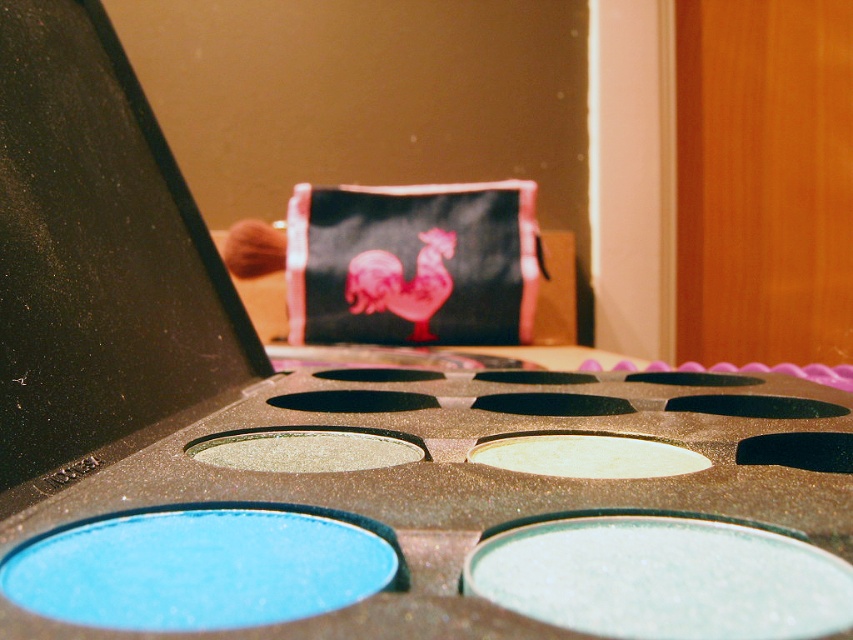
Question: Is satin gold eyeshadow at center further to camera compared to shimmering metallic eyeshadow at center?

Choices:
 (A) no
 (B) yes

Answer: (A)

Question: Among these objects, which one is farthest from the camera?

Choices:
 (A) shimmering teal eyeshadow at center
 (B) satin gold eyeshadow at center
 (C) shimmering metallic eyeshadow at center

Answer: (C)

Question: Does shimmering teal eyeshadow at center have a larger size compared to shimmering metallic eyeshadow at center?

Choices:
 (A) no
 (B) yes

Answer: (A)

Question: Among these objects, which one is nearest to the camera?

Choices:
 (A) shimmering teal eyeshadow at center
 (B) shimmering metallic eyeshadow at center

Answer: (A)

Question: Which object is the farthest from the satin gold eyeshadow at center?

Choices:
 (A) shimmering teal eyeshadow at center
 (B) shimmering metallic eyeshadow at center

Answer: (A)

Question: Can you confirm if shimmering teal eyeshadow at center is thinner than satin gold eyeshadow at center?

Choices:
 (A) yes
 (B) no

Answer: (B)